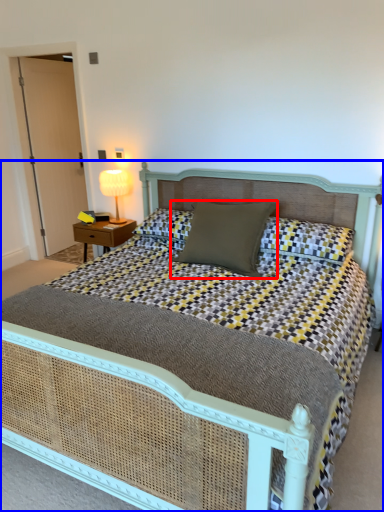
Question: Among these objects, which one is farthest to the camera, pillow (highlighted by a red box) or bed (highlighted by a blue box)?

Choices:
 (A) pillow
 (B) bed

Answer: (A)